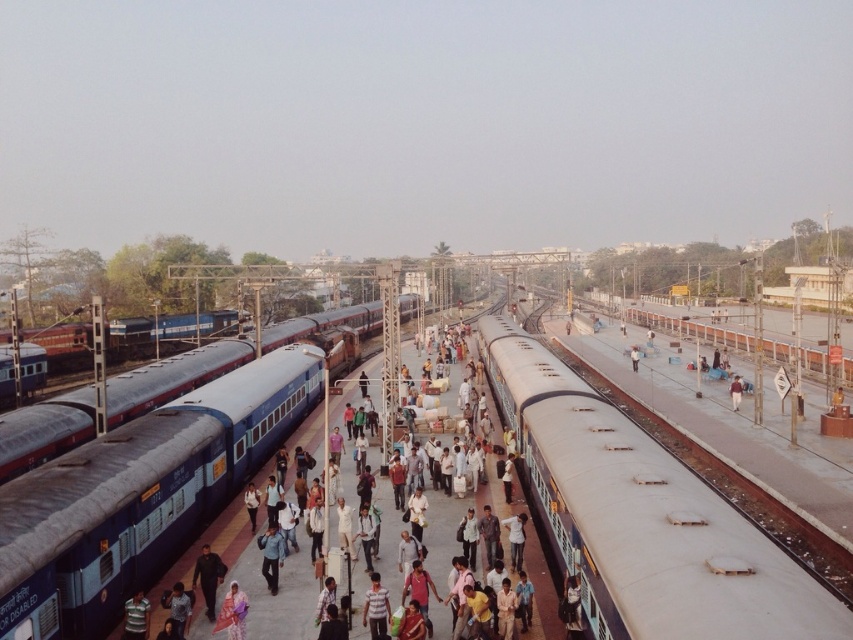
You are standing on the platform at the railway station and want to take a photo of both the passenger train and the freight train. You notice two points marked on the ground where you can stand to frame your shot. The first point is at coordinate point (x=689, y=611), and the second is at point (x=126, y=412). Considering that you want to ensure both trains are clearly visible in your photo, which point should you choose to stand on?

You should choose point (x=689, y=611) because it is closer to the camera, allowing for a clearer view of both the passenger train and the freight train.

You are a commuter on the platform and need to pick up both the metallic silver helmet at center and the brown fabric bag at center. Which item should you pick up first to avoid bending down?

You should pick up the brown fabric bag at center first because the metallic silver helmet at center is located below it, so reaching the bag first would be easier without bending down.